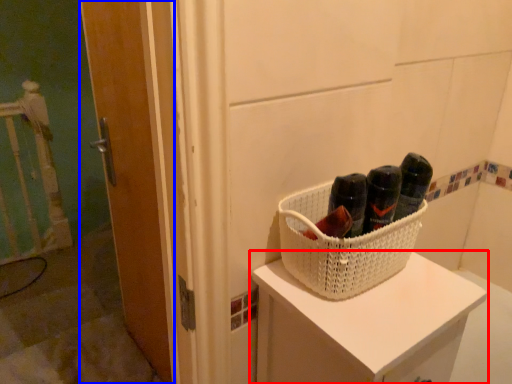
Question: Among these objects, which one is nearest to the camera, furniture (highlighted by a red box) or door (highlighted by a blue box)?

Choices:
 (A) furniture
 (B) door

Answer: (A)